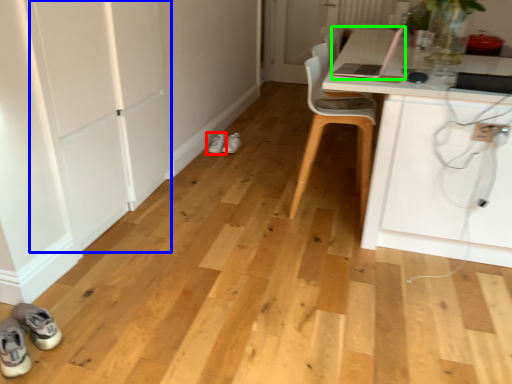
Question: Which object is the farthest from footwear (highlighted by a red box)? Choose among these: door (highlighted by a blue box) or laptop (highlighted by a green box).

Choices:
 (A) door
 (B) laptop

Answer: (B)